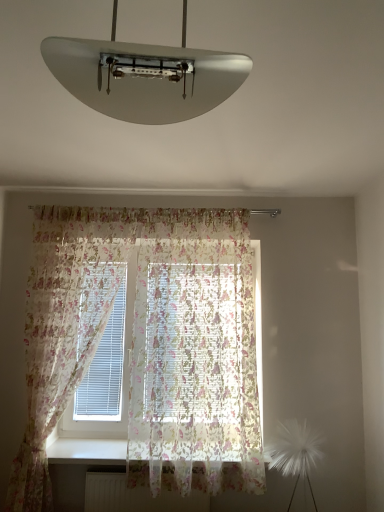
Question: From a real-world perspective, is white glossy lampshade at upper center beneath translucent floral fabric at left, which is the first curtain from left to right?

Choices:
 (A) yes
 (B) no

Answer: (B)

Question: Can you see white glossy lampshade at upper center touching translucent floral fabric at left, which is the first curtain from left to right?

Choices:
 (A) yes
 (B) no

Answer: (B)

Question: Could you tell me if white glossy lampshade at upper center is turned towards translucent floral fabric at left, which is the first curtain from left to right?

Choices:
 (A) yes
 (B) no

Answer: (B)

Question: From the image's perspective, would you say white glossy lampshade at upper center is positioned over translucent floral fabric at left, which is the second curtain from right to left?

Choices:
 (A) no
 (B) yes

Answer: (B)

Question: From the image's perspective, is white glossy lampshade at upper center under translucent floral fabric at left, which is the second curtain from right to left?

Choices:
 (A) no
 (B) yes

Answer: (A)

Question: Is white glossy lampshade at upper center closer to the viewer compared to translucent floral fabric at left, which is the second curtain from right to left?

Choices:
 (A) no
 (B) yes

Answer: (B)

Question: Is translucent floral curtain at center, which is the second curtain from left to right, not inside white smooth window sill at lower center?

Choices:
 (A) yes
 (B) no

Answer: (A)

Question: Does translucent floral curtain at center, which is the second curtain from left to right, come behind white smooth window sill at lower center?

Choices:
 (A) no
 (B) yes

Answer: (A)

Question: Can you confirm if translucent floral curtain at center, which is the second curtain from left to right, is thinner than white smooth window sill at lower center?

Choices:
 (A) yes
 (B) no

Answer: (A)

Question: From a real-world perspective, is translucent floral curtain at center, arranged as the first curtain when viewed from the right, located beneath white smooth window sill at lower center?

Choices:
 (A) yes
 (B) no

Answer: (B)

Question: Are translucent floral curtain at center, which is the second curtain from left to right, and white smooth window sill at lower center far apart?

Choices:
 (A) no
 (B) yes

Answer: (A)

Question: Does translucent floral curtain at center, which is the second curtain from left to right, have a larger size compared to white smooth window sill at lower center?

Choices:
 (A) yes
 (B) no

Answer: (A)

Question: From the image's perspective, is white glossy lampshade at upper center above white smooth window sill at lower center?

Choices:
 (A) yes
 (B) no

Answer: (A)